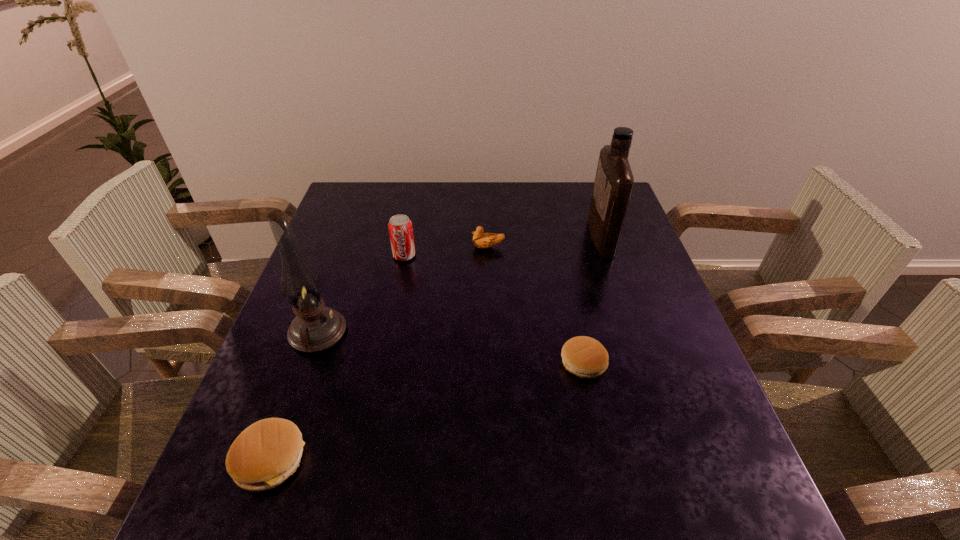
In order to click on the nearer patty in this screenshot , I will do `click(265, 454)`.

Find the location of `the left patty`. the left patty is located at coordinates (265, 454).

This screenshot has height=540, width=960. Identify the location of the shortest object. (585, 357).

Where is `the right patty`? This screenshot has width=960, height=540. the right patty is located at coordinates (585, 357).

The image size is (960, 540). Find the location of `duckling`. duckling is located at coordinates (481, 240).

Identify the location of oil lamp. (315, 328).

Locate an element on the screen. The height and width of the screenshot is (540, 960). soda can is located at coordinates (400, 228).

The height and width of the screenshot is (540, 960). I want to click on the third object from left to right, so click(400, 228).

I want to click on the rightmost object, so 614,181.

This screenshot has width=960, height=540. I want to click on vacant space located 0.150m on the right of the nearest object, so click(388, 460).